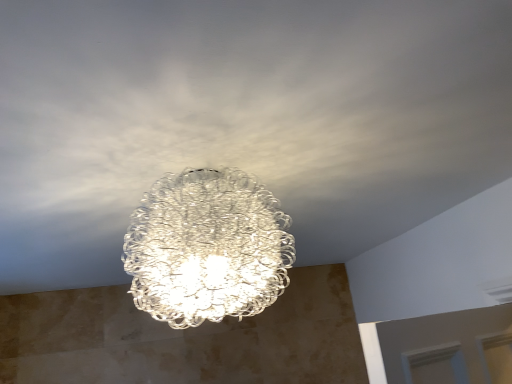
The height and width of the screenshot is (384, 512). What do you see at coordinates (207, 248) in the screenshot? I see `clear glass chandelier at center` at bounding box center [207, 248].

The width and height of the screenshot is (512, 384). In order to click on clear glass chandelier at center in this screenshot , I will do `click(207, 248)`.

Find the location of a particular element. clear glass chandelier at center is located at coordinates point(207,248).